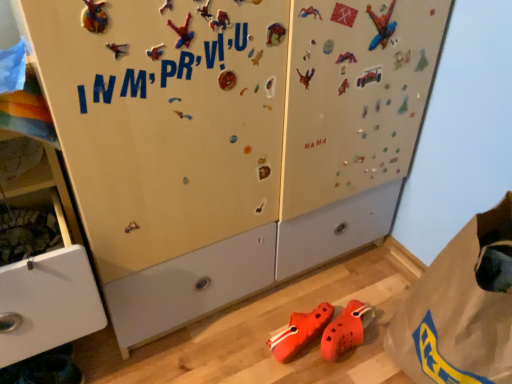
The width and height of the screenshot is (512, 384). What are the coordinates of `vacant region to the right of orange rubber clogs at lower center` in the screenshot? It's located at (381, 343).